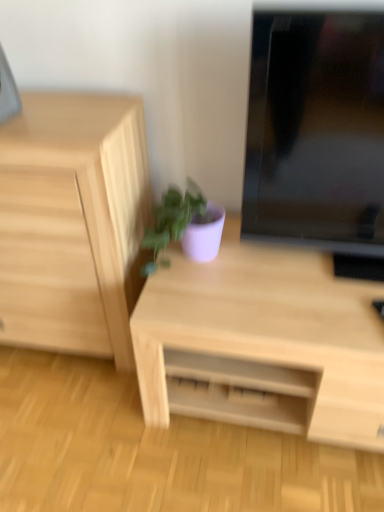
What are the coordinates of `vacant space in front of matte purple pot at center` in the screenshot? It's located at (196, 303).